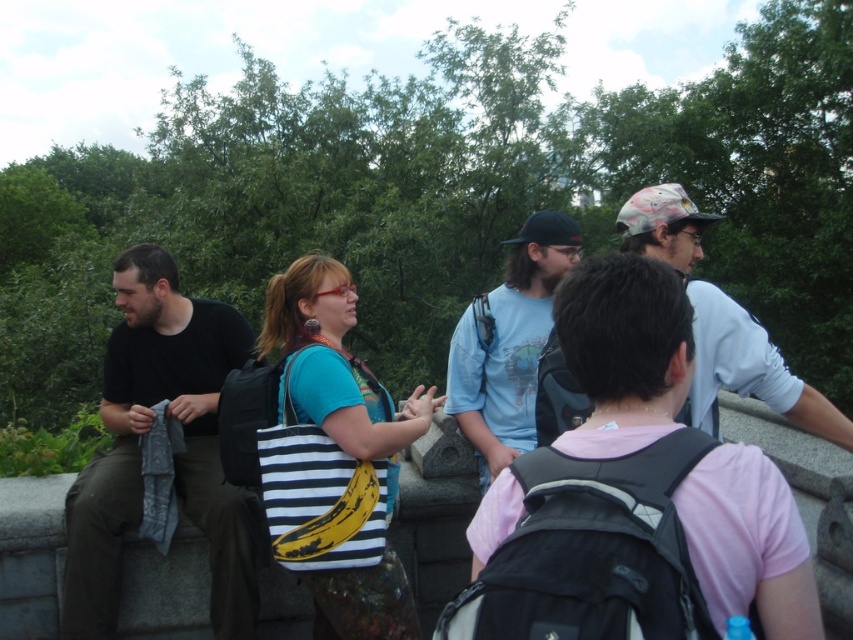
Question: From the image, what is the correct spatial relationship of black matte shirt at left in relation to camouflage fabric cap at upper right?

Choices:
 (A) above
 (B) below

Answer: (B)

Question: Does black matte shirt at left appear over light blue t-shirt at center?

Choices:
 (A) no
 (B) yes

Answer: (A)

Question: Which object appears closest to the camera in this image?

Choices:
 (A) camouflage fabric cap at upper right
 (B) black matte shirt at left

Answer: (A)

Question: Is black matte shirt at left above light blue t-shirt at center?

Choices:
 (A) no
 (B) yes

Answer: (A)

Question: Which point appears closest to the camera in this image?

Choices:
 (A) (181, 484)
 (B) (538, 344)
 (C) (730, 381)

Answer: (C)

Question: Among these objects, which one is farthest from the camera?

Choices:
 (A) light blue t-shirt at center
 (B) camouflage fabric cap at upper right

Answer: (A)